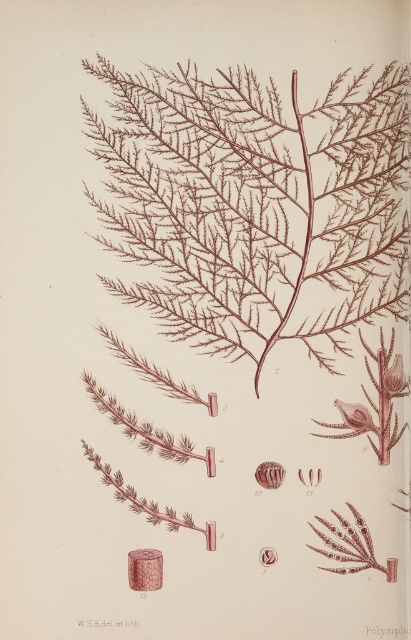
Question: Among these objects, which one is farthest from the camera?

Choices:
 (A) matte pink flower at upper right
 (B) brown textured plant at center

Answer: (A)

Question: Among these objects, which one is nearest to the camera?

Choices:
 (A) matte pink flower at upper right
 (B) brown textured plant at center

Answer: (B)

Question: From the image, what is the correct spatial relationship of brown textured plant at center in relation to matte pink flower at upper right?

Choices:
 (A) left
 (B) right

Answer: (A)

Question: Does brown textured plant at center appear over matte pink flower at upper right?

Choices:
 (A) yes
 (B) no

Answer: (A)

Question: Can you confirm if brown textured plant at center is positioned to the right of matte pink flower at upper right?

Choices:
 (A) yes
 (B) no

Answer: (B)